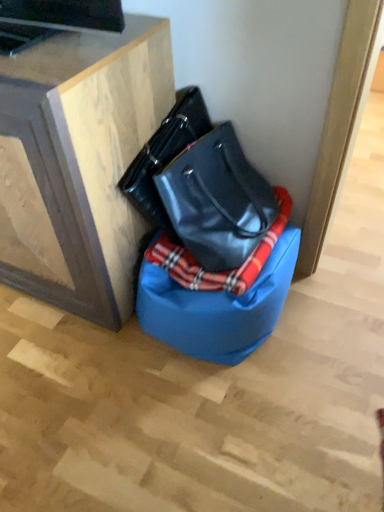
Locate an element on the screen. This screenshot has width=384, height=512. spots to the right of blue fabric bean bag chair at lower center is located at coordinates pyautogui.click(x=330, y=334).